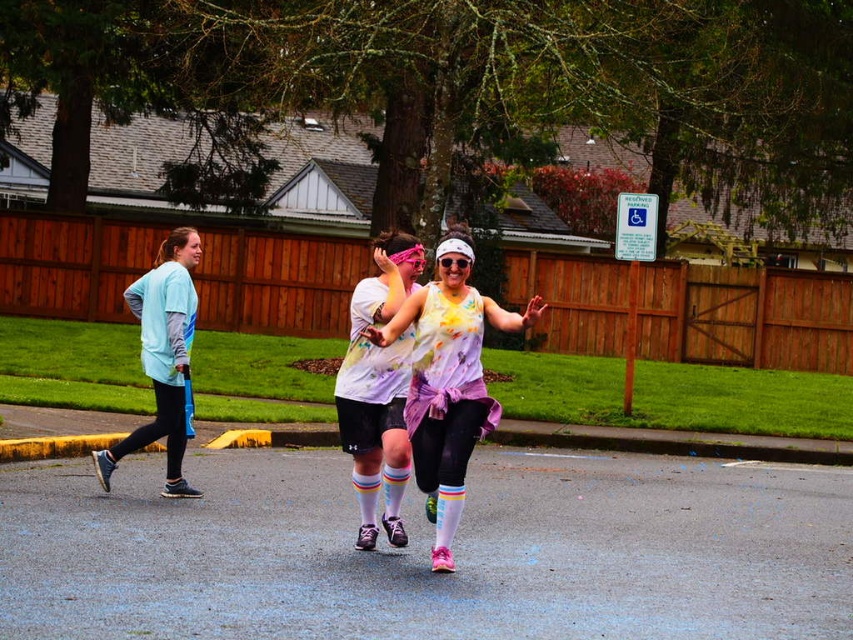
You are a photographer at the fun run event and want to capture a photo of the light blue fabric shirt at left and the rainbow striped socks at center. Based on their positions, which object is closer to the camera?

The rainbow striped socks at center is positioned under the light blue fabric shirt at left, meaning the light blue fabric shirt at left is closer to the camera.